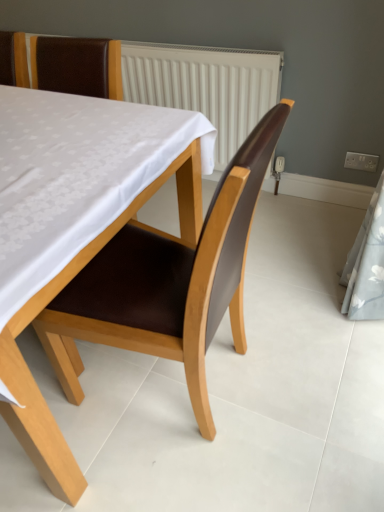
What do you see at coordinates (77, 66) in the screenshot?
I see `brown leather chair at upper left, acting as the second chair starting from the bottom` at bounding box center [77, 66].

The height and width of the screenshot is (512, 384). What are the coordinates of `brown leather chair at upper left, which is the 1th chair from top to bottom` in the screenshot? It's located at (77, 66).

The height and width of the screenshot is (512, 384). What do you see at coordinates (168, 282) in the screenshot? I see `brown leather chair at center, marked as the 2th chair in a top-to-bottom arrangement` at bounding box center [168, 282].

Find the location of a particular element. Image resolution: width=384 pixels, height=512 pixels. brown leather chair at center, marked as the 2th chair in a top-to-bottom arrangement is located at coordinates (168, 282).

Where is `brown leather chair at upper left, which is the 1th chair from top to bottom`? This screenshot has width=384, height=512. brown leather chair at upper left, which is the 1th chair from top to bottom is located at coordinates (77, 66).

Would you say brown leather chair at upper left, acting as the second chair starting from the bottom, is to the left or to the right of brown leather chair at center, marked as the 2th chair in a top-to-bottom arrangement, in the picture?

Based on their positions, brown leather chair at upper left, acting as the second chair starting from the bottom, is located to the left of brown leather chair at center, marked as the 2th chair in a top-to-bottom arrangement.

Is the depth of brown leather chair at upper left, which is the 1th chair from top to bottom, greater than that of brown leather chair at center, marked as the 2th chair in a top-to-bottom arrangement?

Yes, it is behind brown leather chair at center, marked as the 2th chair in a top-to-bottom arrangement.

Considering the positions of points (85, 77) and (266, 164), is point (85, 77) farther from camera compared to point (266, 164)?

Yes, point (85, 77) is behind point (266, 164).

From the image's perspective, which object appears higher, brown leather chair at upper left, which is the 1th chair from top to bottom, or brown leather chair at center, marked as the 2th chair in a top-to-bottom arrangement?

brown leather chair at upper left, which is the 1th chair from top to bottom, appears higher in the image.

From a real-world perspective, is brown leather chair at upper left, acting as the second chair starting from the bottom, physically located above or below brown leather chair at center, marked as the 2th chair in a top-to-bottom arrangement?

brown leather chair at upper left, acting as the second chair starting from the bottom, is situated higher than brown leather chair at center, marked as the 2th chair in a top-to-bottom arrangement, in the real world.

Which of these two, brown leather chair at upper left, which is the 1th chair from top to bottom, or brown leather chair at center, the 1th chair ordered from the bottom, is thinner?

brown leather chair at upper left, which is the 1th chair from top to bottom.

Can you confirm if brown leather chair at upper left, which is the 1th chair from top to bottom, is shorter than brown leather chair at center, marked as the 2th chair in a top-to-bottom arrangement?

Correct, brown leather chair at upper left, which is the 1th chair from top to bottom, is not as tall as brown leather chair at center, marked as the 2th chair in a top-to-bottom arrangement.

Looking at the image, does brown leather chair at upper left, acting as the second chair starting from the bottom, seem bigger or smaller compared to brown leather chair at center, marked as the 2th chair in a top-to-bottom arrangement?

Considering their sizes, brown leather chair at upper left, acting as the second chair starting from the bottom, takes up less space than brown leather chair at center, marked as the 2th chair in a top-to-bottom arrangement.

Is brown leather chair at center, marked as the 2th chair in a top-to-bottom arrangement, a part of brown leather chair at upper left, acting as the second chair starting from the bottom?

No.

Are brown leather chair at upper left, acting as the second chair starting from the bottom, and brown leather chair at center, the 1th chair ordered from the bottom, located far from each other?

brown leather chair at upper left, acting as the second chair starting from the bottom, is near brown leather chair at center, the 1th chair ordered from the bottom, not far away.

Is brown leather chair at upper left, acting as the second chair starting from the bottom, oriented away from brown leather chair at center, the 1th chair ordered from the bottom?

No, brown leather chair at upper left, acting as the second chair starting from the bottom,'s orientation is not away from brown leather chair at center, the 1th chair ordered from the bottom.

Can you tell me how much brown leather chair at upper left, which is the 1th chair from top to bottom, and brown leather chair at center, the 1th chair ordered from the bottom, differ in facing direction?

They differ by 90 degrees in their facing directions.

Locate an element on the screen. chair that appears on the left of brown leather chair at center, marked as the 2th chair in a top-to-bottom arrangement is located at coordinates (77, 66).

Considering the positions of objects brown leather chair at center, the 1th chair ordered from the bottom, and brown leather chair at upper left, which is the 1th chair from top to bottom, in the image provided, who is more to the right, brown leather chair at center, the 1th chair ordered from the bottom, or brown leather chair at upper left, which is the 1th chair from top to bottom,?

From the viewer's perspective, brown leather chair at center, the 1th chair ordered from the bottom, appears more on the right side.

Considering the positions of objects brown leather chair at center, marked as the 2th chair in a top-to-bottom arrangement, and brown leather chair at upper left, acting as the second chair starting from the bottom, in the image provided, who is in front, brown leather chair at center, marked as the 2th chair in a top-to-bottom arrangement, or brown leather chair at upper left, acting as the second chair starting from the bottom,?

brown leather chair at center, marked as the 2th chair in a top-to-bottom arrangement, is closer to the camera.

Between point (219, 206) and point (105, 85), which one is positioned in front?

The point (219, 206) is closer to the camera.

From the image's perspective, between brown leather chair at center, the 1th chair ordered from the bottom, and brown leather chair at upper left, which is the 1th chair from top to bottom, which one is located above?

brown leather chair at upper left, which is the 1th chair from top to bottom, appears higher in the image.

In the scene shown: From a real-world perspective, does brown leather chair at center, the 1th chair ordered from the bottom, stand above brown leather chair at upper left, which is the 1th chair from top to bottom?

Incorrect, from a real-world perspective, brown leather chair at center, the 1th chair ordered from the bottom, is lower than brown leather chair at upper left, which is the 1th chair from top to bottom.

Considering the sizes of objects brown leather chair at center, the 1th chair ordered from the bottom, and brown leather chair at upper left, which is the 1th chair from top to bottom, in the image provided, who is thinner, brown leather chair at center, the 1th chair ordered from the bottom, or brown leather chair at upper left, which is the 1th chair from top to bottom,?

brown leather chair at upper left, which is the 1th chair from top to bottom.

Is brown leather chair at center, the 1th chair ordered from the bottom, taller or shorter than brown leather chair at upper left, acting as the second chair starting from the bottom?

Clearly, brown leather chair at center, the 1th chair ordered from the bottom, is taller compared to brown leather chair at upper left, acting as the second chair starting from the bottom.

Can you confirm if brown leather chair at center, marked as the 2th chair in a top-to-bottom arrangement, is smaller than brown leather chair at upper left, which is the 1th chair from top to bottom?

Incorrect, brown leather chair at center, marked as the 2th chair in a top-to-bottom arrangement, is not smaller in size than brown leather chair at upper left, which is the 1th chair from top to bottom.

Can brown leather chair at upper left, acting as the second chair starting from the bottom, be found inside brown leather chair at center, the 1th chair ordered from the bottom?

No, brown leather chair at upper left, acting as the second chair starting from the bottom, is located outside of brown leather chair at center, the 1th chair ordered from the bottom.

Are brown leather chair at center, marked as the 2th chair in a top-to-bottom arrangement, and brown leather chair at upper left, which is the 1th chair from top to bottom, far apart?

They are positioned close to each other.

Is brown leather chair at center, the 1th chair ordered from the bottom, facing towards brown leather chair at upper left, which is the 1th chair from top to bottom?

No, brown leather chair at center, the 1th chair ordered from the bottom, is not facing towards brown leather chair at upper left, which is the 1th chair from top to bottom.

Can you tell me how much brown leather chair at center, marked as the 2th chair in a top-to-bottom arrangement, and brown leather chair at upper left, which is the 1th chair from top to bottom, differ in facing direction?

The facing directions of brown leather chair at center, marked as the 2th chair in a top-to-bottom arrangement, and brown leather chair at upper left, which is the 1th chair from top to bottom, are 90 degrees apart.

Could you measure the distance between brown leather chair at center, the 1th chair ordered from the bottom, and brown leather chair at upper left, which is the 1th chair from top to bottom?

brown leather chair at center, the 1th chair ordered from the bottom, and brown leather chair at upper left, which is the 1th chair from top to bottom, are 72.12 centimeters apart from each other.

At what (x,y) coordinates should I click in order to perform the action: click on chair above the brown leather chair at center, the 1th chair ordered from the bottom (from the image's perspective). Please return your answer as a coordinate pair (x, y). Looking at the image, I should click on (77, 66).

The height and width of the screenshot is (512, 384). I want to click on chair that appears below the brown leather chair at upper left, which is the 1th chair from top to bottom (from a real-world perspective), so click(168, 282).

This screenshot has width=384, height=512. I want to click on chair that appears below the brown leather chair at upper left, which is the 1th chair from top to bottom (from the image's perspective), so click(x=168, y=282).